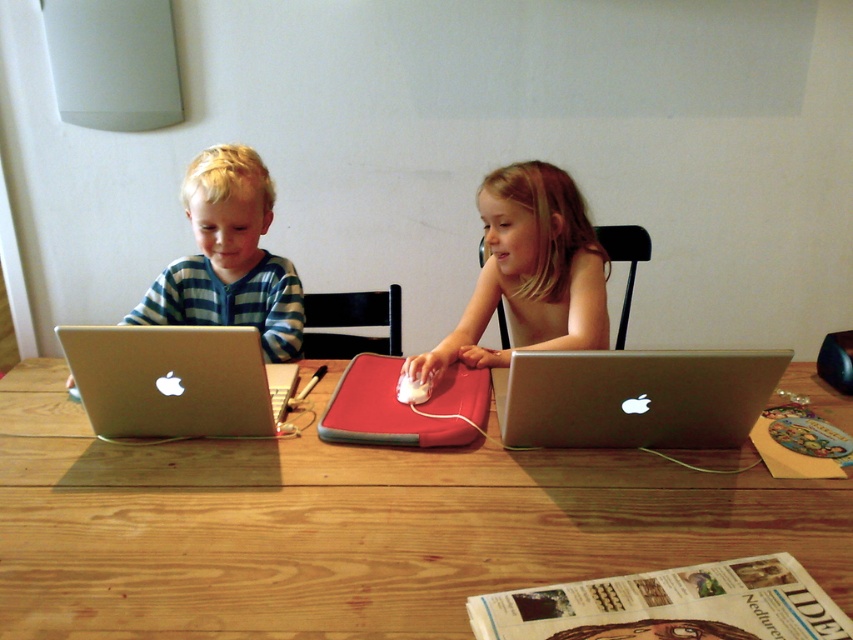
You are a teacher observing the children at the wooden table. You notice two laptops in front of them. Which laptop, the silver metallic laptop at center or the matte silver laptop at left, is wider?

The silver metallic laptop at center might be wider than the matte silver laptop at left.

You are a photographer taking a portrait of the smooth skin girl at center and the matte silver laptop at left. Based on their widths, which subject should you focus on to ensure they appear larger in the photo?

The smooth skin girl at center has a greater width than the matte silver laptop at left, so focusing on her will make her appear larger in the photo.

You are a photographer setting up a shoot. You need to position a light source so that it illuminates both the smooth skin girl at center and the matte silver laptop at left. Considering their heights, which object should be placed closer to the light source to ensure both are adequately lit?

The smooth skin girl at center is not as tall as the matte silver laptop at left, so the girl should be placed closer to the light source to ensure both receive adequate lighting.